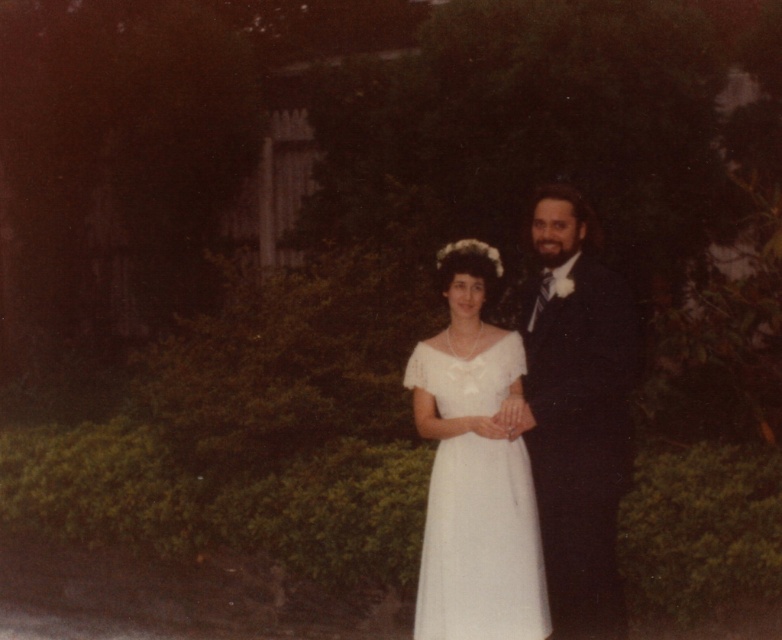
Does shiny black suit at right have a larger size compared to white satin dress at center?

Indeed, shiny black suit at right has a larger size compared to white satin dress at center.

Can you confirm if shiny black suit at right is shorter than white satin dress at center?

In fact, shiny black suit at right may be taller than white satin dress at center.

Is point (571, 564) farther from camera compared to point (456, 451)?

No.

Locate an element on the screen. shiny black suit at right is located at coordinates (576, 410).